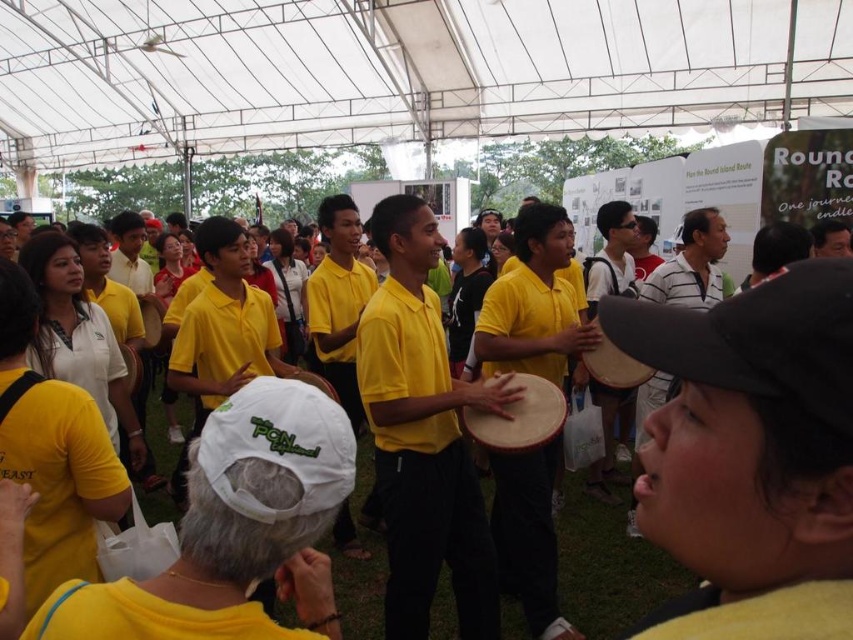
Question: Which point appears farthest from the camera in this image?

Choices:
 (A) (148, 518)
 (B) (527, 403)

Answer: (A)

Question: Does yellow matte shirt at center have a larger size compared to wooden drum at center?

Choices:
 (A) no
 (B) yes

Answer: (B)

Question: Which of the following is the farthest from the observer?

Choices:
 (A) (368, 620)
 (B) (474, 410)

Answer: (A)

Question: Does yellow matte shirt at center have a smaller size compared to wooden drum at center?

Choices:
 (A) yes
 (B) no

Answer: (B)

Question: Is yellow matte shirt at center to the right of wooden drum at center from the viewer's perspective?

Choices:
 (A) yes
 (B) no

Answer: (A)

Question: Among these points, which one is farthest from the camera?

Choices:
 (A) [x=486, y=420]
 (B) [x=643, y=600]

Answer: (B)